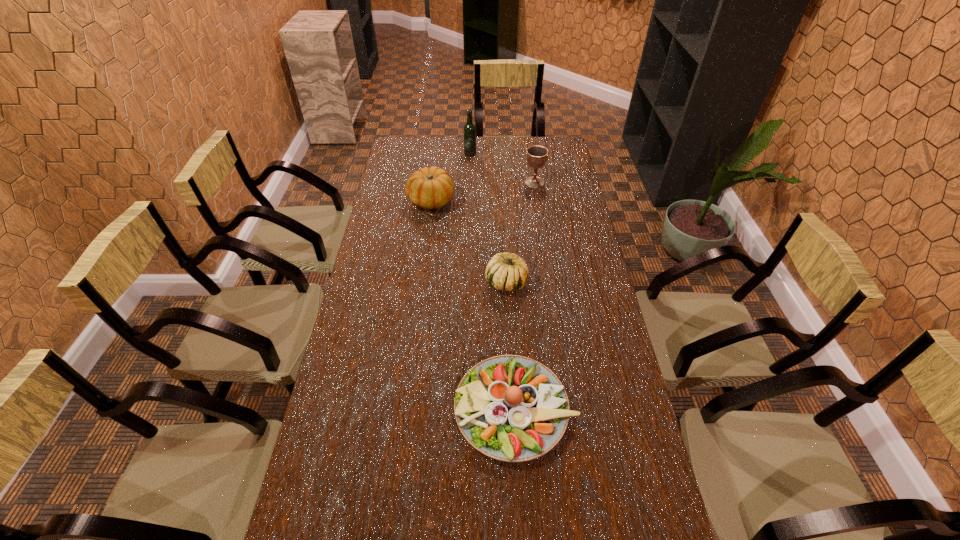
What are the coordinates of `free space located 0.250m on the left of the chalice` in the screenshot? It's located at (467, 183).

Image resolution: width=960 pixels, height=540 pixels. I want to click on blank area located 0.370m on the right of the left gourd, so click(x=544, y=200).

At what (x,y) coordinates should I click in order to perform the action: click on vacant space situated on the right of the right gourd. Please return your answer as a coordinate pair (x, y). The image size is (960, 540). Looking at the image, I should click on (601, 282).

Locate an element on the screen. The height and width of the screenshot is (540, 960). vacant space situated on the left of the nearest object is located at coordinates (380, 409).

The width and height of the screenshot is (960, 540). I want to click on object positioned at the far edge, so click(469, 128).

Where is `object present at the left edge`? object present at the left edge is located at coordinates (429, 188).

This screenshot has width=960, height=540. Identify the location of chalice that is at the right edge. (537, 156).

Identify the location of salad plate that is positioned at the right edge. (511, 408).

The height and width of the screenshot is (540, 960). Find the location of `blank space at the far edge of the desktop`. blank space at the far edge of the desktop is located at coordinates (455, 161).

This screenshot has height=540, width=960. I want to click on free space at the left edge of the desktop, so click(375, 328).